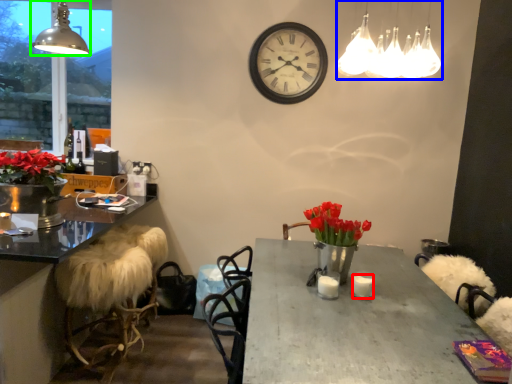
Question: Which is nearer to the candle (highlighted by a red box)? lamp (highlighted by a blue box) or lamp (highlighted by a green box).

Choices:
 (A) lamp
 (B) lamp

Answer: (A)